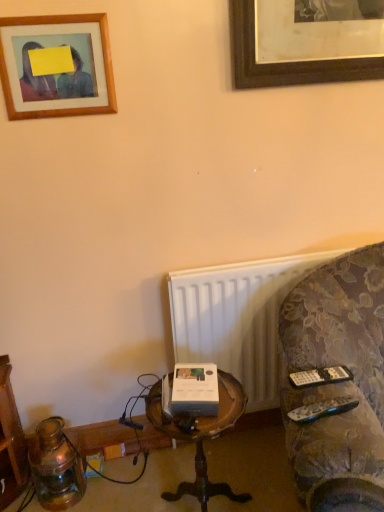
Question: Is black plastic remote at right, the 1th remote in the back-to-front sequence, taller or shorter than white plastic radiator at lower right?

Choices:
 (A) tall
 (B) short

Answer: (B)

Question: In the image, is black plastic remote at right, which is the 2th remote from front to back, on the left side or the right side of white plastic radiator at lower right?

Choices:
 (A) right
 (B) left

Answer: (A)

Question: Which of these objects is positioned closest to the woodenobject at center?

Choices:
 (A) velvet-patterned couch at right
 (B) black plastic remote at right, the 1th remote in the back-to-front sequence
 (C) antique brass lantern at lower left
 (D) wooden picture frame at upper left
 (E) white plastic radiator at lower right

Answer: (E)

Question: Estimate the real-world distances between objects in this image. Which object is closer to the black plastic remote at right, which is the 2th remote from front to back?

Choices:
 (A) wooden picture frame at upper left
 (B) woodenobject at center
 (C) white plastic radiator at lower right
 (D) antique brass lantern at lower left
 (E) velvet-patterned couch at right

Answer: (E)